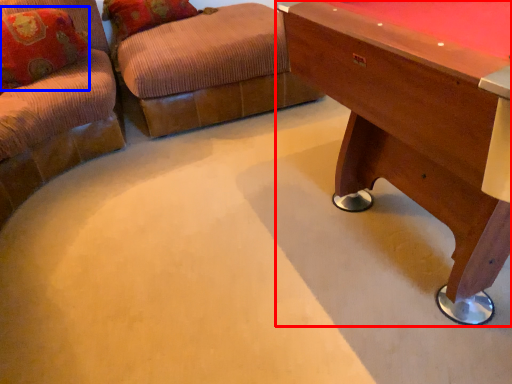
Question: Which object is closer to the camera taking this photo, table (highlighted by a red box) or pillow (highlighted by a blue box)?

Choices:
 (A) table
 (B) pillow

Answer: (A)